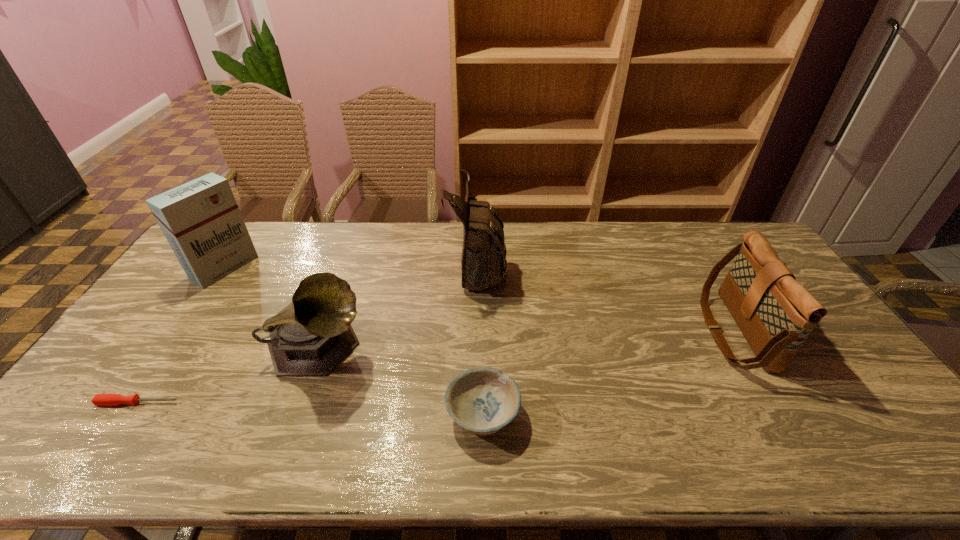
Find the location of a particular element. The image size is (960, 540). empty space that is in between the third object from left to right and the tallest object is located at coordinates (397, 307).

Where is `unoccupied position between the rightmost object and the screwdriver`? unoccupied position between the rightmost object and the screwdriver is located at coordinates (436, 367).

Select which object is the closest to the screwdriver. Please provide its 2D coordinates. Your answer should be formatted as a tuple, i.e. [(x, y)], where the tuple contains the x and y coordinates of a point satisfying the conditions above.

[(313, 334)]

Select which object appears as the third closest to the phonograph record. Please provide its 2D coordinates. Your answer should be formatted as a tuple, i.e. [(x, y)], where the tuple contains the x and y coordinates of a point satisfying the conditions above.

[(483, 261)]

The width and height of the screenshot is (960, 540). Identify the location of free space that satisfies the following two spatial constraints: 1. on the horn direction of the phonograph record; 2. on the back side of the bowl. (295, 414).

This screenshot has width=960, height=540. Identify the location of blank area in the image that satisfies the following two spatial constraints: 1. on the horn direction of the bowl; 2. on the right side of the third object from left to right. (295, 414).